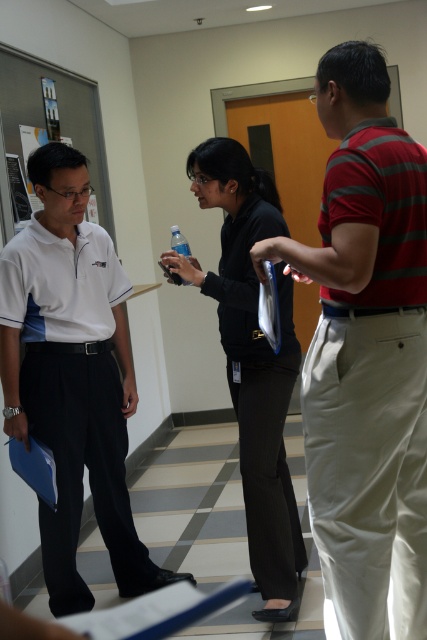
Which is below, striped cotton polo shirt at right or white matte polo shirt at left?

Positioned lower is striped cotton polo shirt at right.

Where is `striped cotton polo shirt at right`? The width and height of the screenshot is (427, 640). striped cotton polo shirt at right is located at coordinates (365, 355).

Measure the distance between striped cotton polo shirt at right and camera.

A distance of 5.99 feet exists between striped cotton polo shirt at right and camera.

Locate an element on the screen. Image resolution: width=427 pixels, height=640 pixels. striped cotton polo shirt at right is located at coordinates (365, 355).

Which is more to the right, black matte pants at center or white matte polo shirt at left?

Positioned to the right is black matte pants at center.

Does black matte pants at center lie in front of white matte polo shirt at left?

No.

Identify the location of black matte pants at center. (253, 360).

Is striped cotton polo shirt at right to the left of clear plastic bottle at center from the viewer's perspective?

No, striped cotton polo shirt at right is not to the left of clear plastic bottle at center.

Which of these two, striped cotton polo shirt at right or clear plastic bottle at center, stands shorter?

With less height is clear plastic bottle at center.

You are a GUI agent. You are given a task and a screenshot of the screen. Output one action in this format:
    pyautogui.click(x=<x>, y=<y>)
    Task: Click on the striped cotton polo shirt at right
    The width and height of the screenshot is (427, 640).
    Given the screenshot: What is the action you would take?
    pyautogui.click(x=365, y=355)

Where is `striped cotton polo shirt at right`? The height and width of the screenshot is (640, 427). striped cotton polo shirt at right is located at coordinates (365, 355).